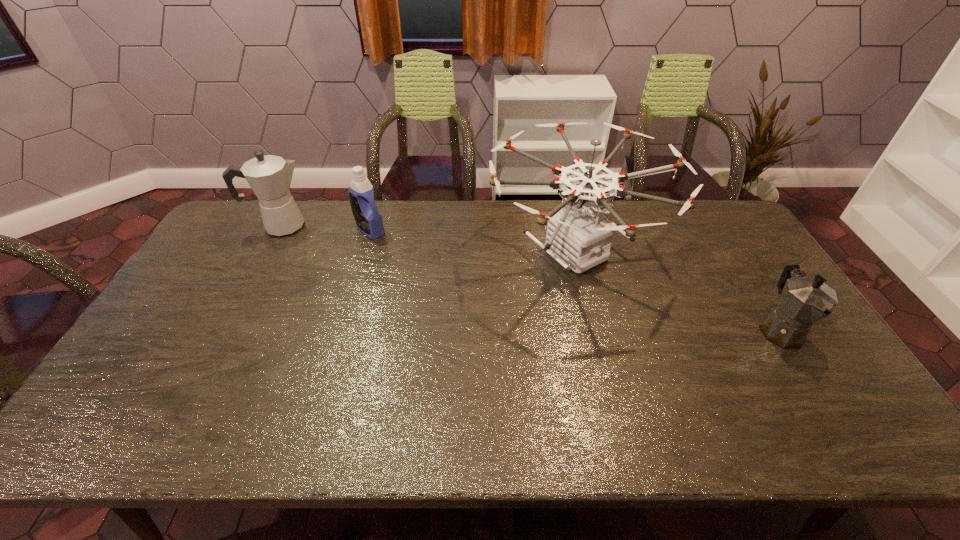
The height and width of the screenshot is (540, 960). In the image, there is a desktop. Find the location of `vacant space at the far left corner`. vacant space at the far left corner is located at coordinates (245, 200).

The image size is (960, 540). I want to click on free space at the far right corner of the desktop, so click(x=718, y=227).

Identify the location of free spot between the nearer coffeepot and the taller coffeepot. This screenshot has width=960, height=540. (531, 278).

Identify the location of empty location between the third object from left to right and the detergent. (472, 241).

At what (x,y) coordinates should I click in order to perform the action: click on free spot between the left coffeepot and the tallest object. Please return your answer as a coordinate pair (x, y). This screenshot has height=540, width=960. Looking at the image, I should click on (428, 239).

I want to click on vacant region between the detergent and the tallest object, so click(472, 241).

The width and height of the screenshot is (960, 540). In order to click on free space between the drone and the detergent in this screenshot , I will do `click(472, 241)`.

Find the location of a particular element. free area in between the farther coffeepot and the tallest object is located at coordinates (428, 239).

Where is `free space that is in between the detergent and the drone`? Image resolution: width=960 pixels, height=540 pixels. free space that is in between the detergent and the drone is located at coordinates (472, 241).

Identify the location of free spot between the farther coffeepot and the second object from left to right. (326, 228).